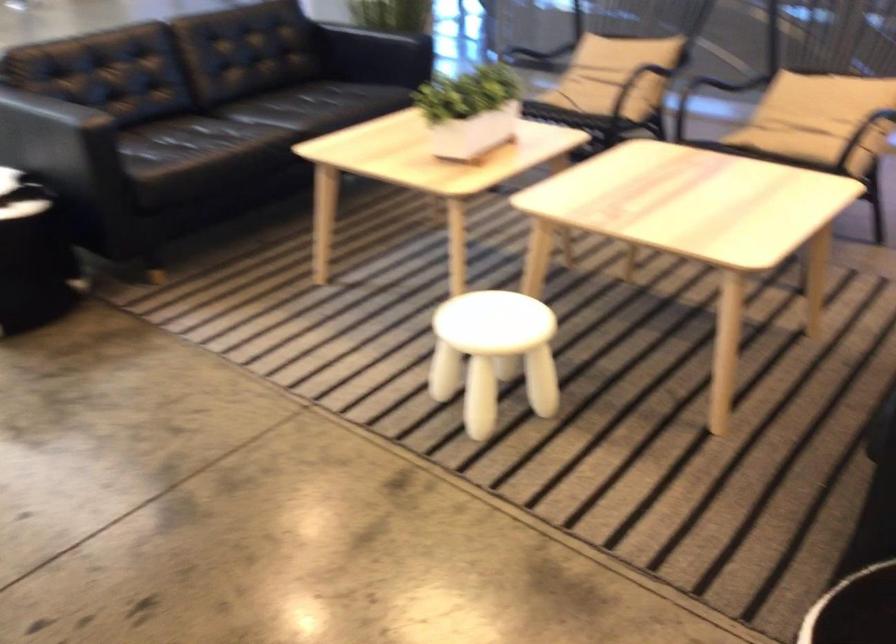
Question: How did the camera likely rotate?

Choices:
 (A) Left
 (B) Right
 (C) Up
 (D) Down

Answer: (B)